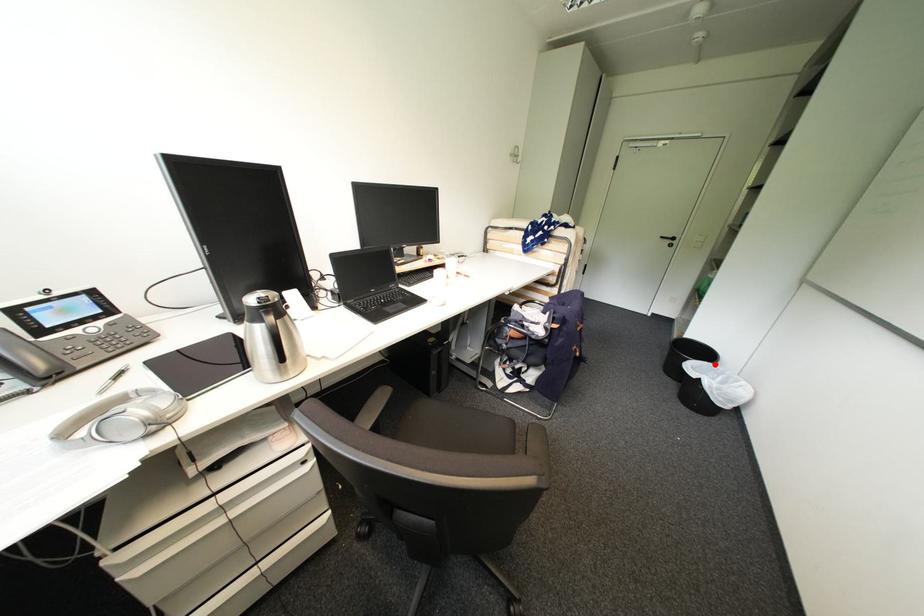
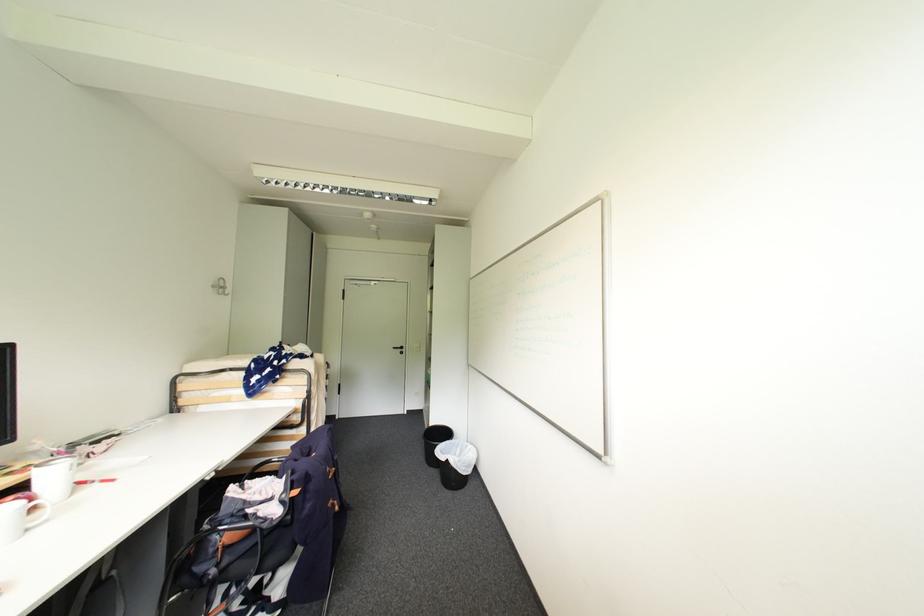
Find the pixel in the second image that matches the highlighted location in the first image.

(456, 442)